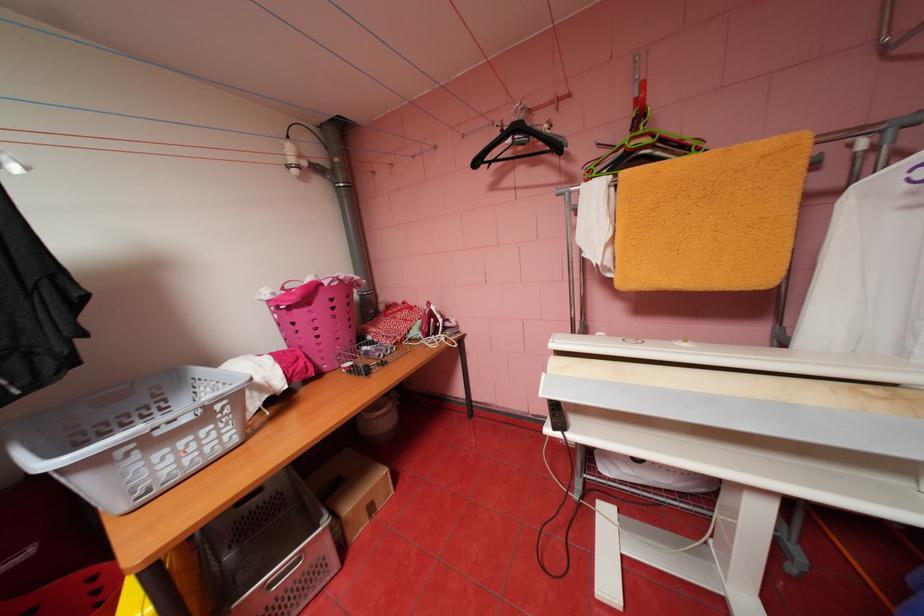
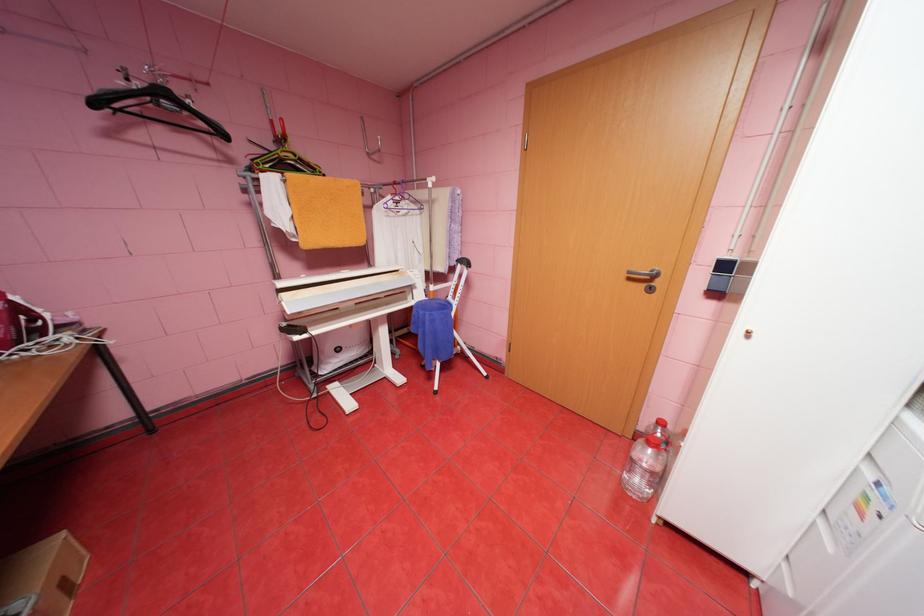
In the second image, find the point that corresponds to the point at 484,163 in the first image.

(103, 103)